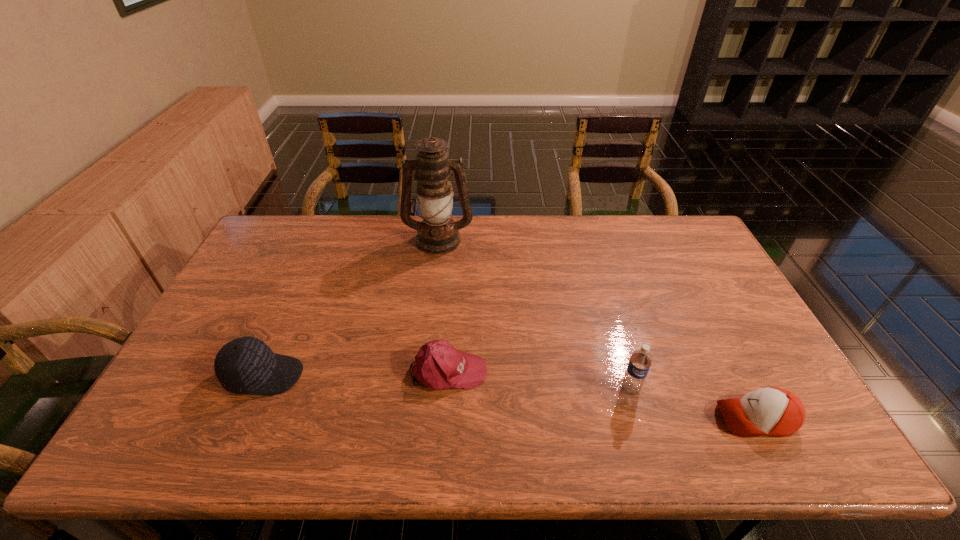
This screenshot has height=540, width=960. I want to click on vacant region that satisfies the following two spatial constraints: 1. at the front of the second tallest object where the brim is located; 2. on the left side of the third tallest object, so click(258, 389).

This screenshot has height=540, width=960. I want to click on vacant space that satisfies the following two spatial constraints: 1. at the front of the tallest baseball cap where the brim is located; 2. on the right side of the fourth object from left to right, so click(258, 389).

This screenshot has width=960, height=540. I want to click on free location that satisfies the following two spatial constraints: 1. at the front of the leftmost object where the brim is located; 2. on the left side of the water bottle, so click(258, 389).

You are a GUI agent. You are given a task and a screenshot of the screen. Output one action in this format:
    pyautogui.click(x=<x>, y=<y>)
    Task: Click on the free spot that satisfies the following two spatial constraints: 1. on the front side of the lantern; 2. at the front of the leftmost baseball cap where the brim is located
    The width and height of the screenshot is (960, 540).
    Given the screenshot: What is the action you would take?
    pyautogui.click(x=422, y=375)

At what (x,y) coordinates should I click in order to perform the action: click on free spot that satisfies the following two spatial constraints: 1. on the front side of the lantern; 2. at the front of the leftmost baseball cap where the brim is located. Please return your answer as a coordinate pair (x, y). Looking at the image, I should click on (422, 375).

The height and width of the screenshot is (540, 960). I want to click on vacant area in the image that satisfies the following two spatial constraints: 1. at the front of the second tallest object with the brim; 2. on the right side of the second baseball cap from left to right, so click(x=447, y=389).

The width and height of the screenshot is (960, 540). What are the coordinates of `vacant space that satisfies the following two spatial constraints: 1. on the back side of the water bottle; 2. at the front of the tallest baseball cap where the brim is located` in the screenshot? It's located at (627, 375).

Find the location of `vacant point that satisfies the following two spatial constraints: 1. on the front side of the lantern; 2. on the right side of the water bottle`. vacant point that satisfies the following two spatial constraints: 1. on the front side of the lantern; 2. on the right side of the water bottle is located at coordinates (421, 389).